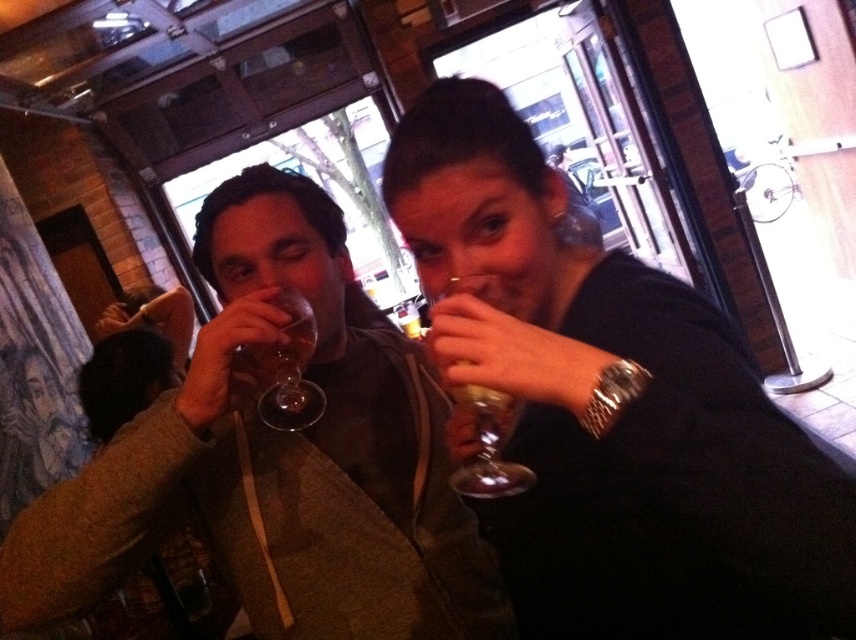
Question: Does matte glass wine glass at center appear over transparent glass wine glass at center?

Choices:
 (A) yes
 (B) no

Answer: (B)

Question: Which object is closer to the camera taking this photo?

Choices:
 (A) black leather jacket at upper right
 (B) transparent glass at upper center
 (C) matte glass wine glass at center
 (D) transparent glass wine glass at center

Answer: (A)

Question: Considering the relative positions of matte glass wine glass at center and transparent glass wine glass at center in the image provided, where is matte glass wine glass at center located with respect to transparent glass wine glass at center?

Choices:
 (A) left
 (B) right

Answer: (B)

Question: From the image, what is the correct spatial relationship of black leather jacket at upper right in relation to transparent glass at upper center?

Choices:
 (A) above
 (B) below

Answer: (A)

Question: Which point appears closest to the camera in this image?

Choices:
 (A) (370, 484)
 (B) (289, 356)
 (C) (498, 493)

Answer: (C)

Question: Which object is positioned closest to the transparent glass at upper center?

Choices:
 (A) matte glass wine glass at center
 (B) transparent glass wine glass at center

Answer: (B)